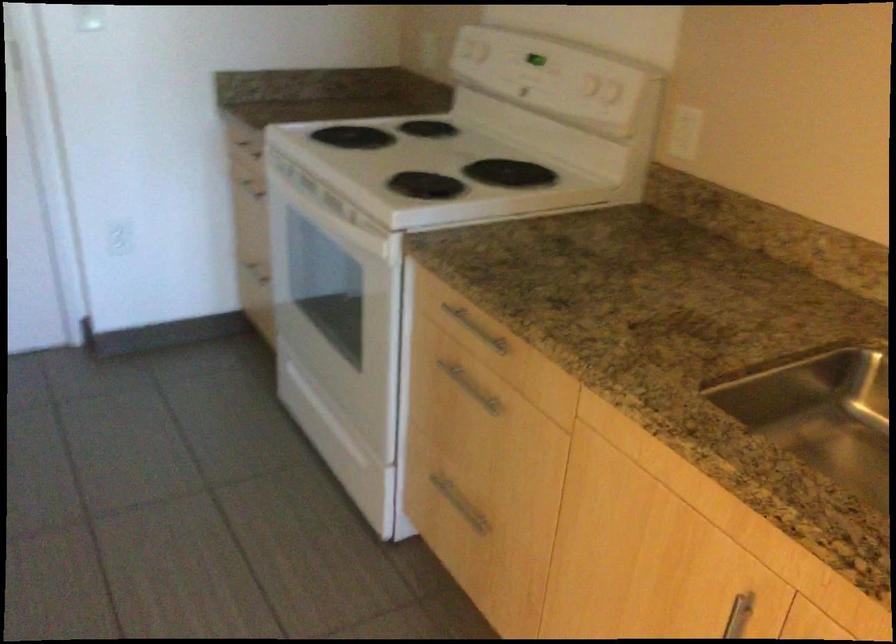
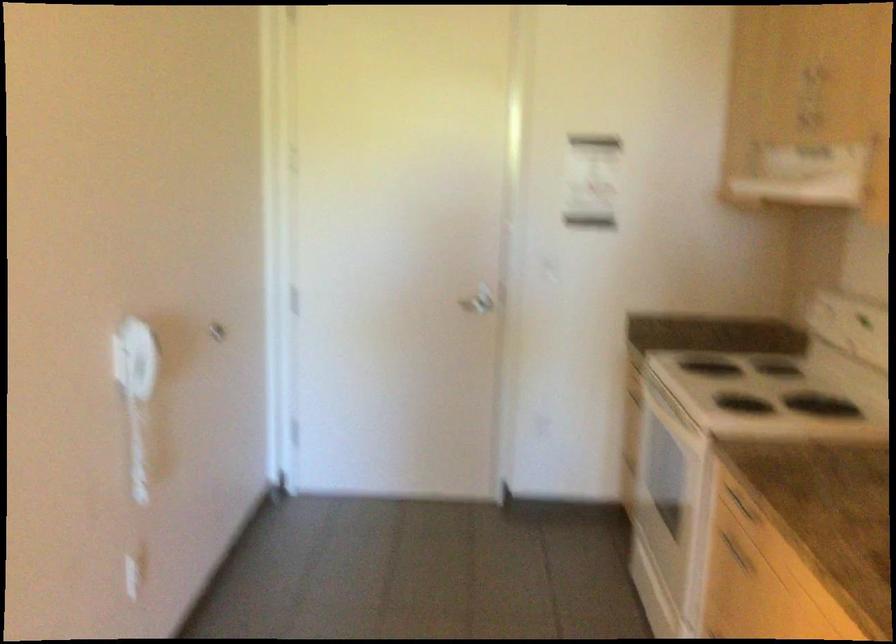
Find the pixel in the second image that matches pixel 457 383 in the first image.

(735, 552)